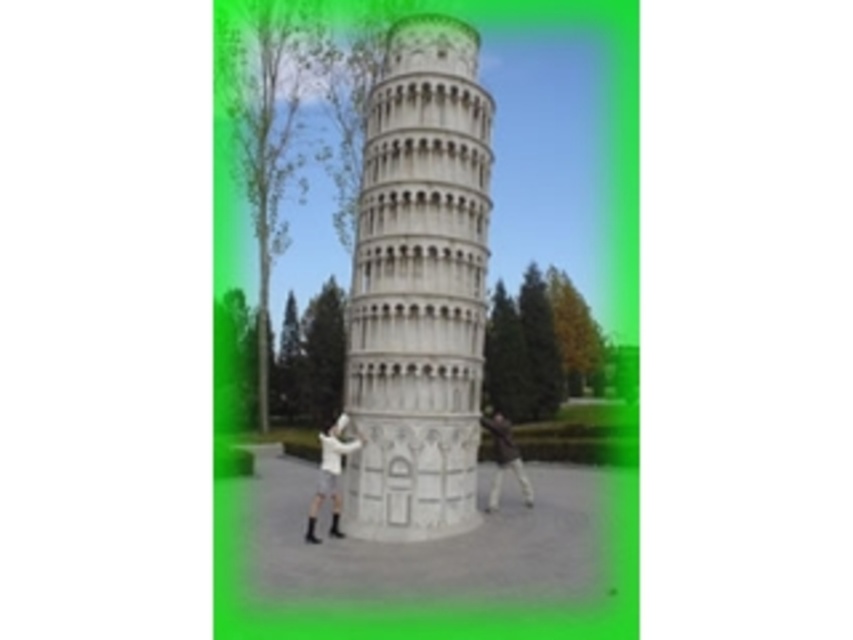
Question: Does white fabric shirt at center have a smaller size compared to dark brown leather jacket at lower right?

Choices:
 (A) yes
 (B) no

Answer: (A)

Question: From the image, what is the correct spatial relationship of white stone tower at center in relation to white fabric shirt at center?

Choices:
 (A) right
 (B) left

Answer: (A)

Question: Does white stone tower at center have a smaller size compared to white fabric shirt at center?

Choices:
 (A) yes
 (B) no

Answer: (B)

Question: Which of the following is the closest to the observer?

Choices:
 (A) dark brown leather jacket at lower right
 (B) white fabric shirt at center
 (C) white stone tower at center

Answer: (C)

Question: Which point appears farthest from the camera in this image?

Choices:
 (A) (456, 211)
 (B) (497, 486)

Answer: (B)

Question: Which of the following is the farthest from the observer?

Choices:
 (A) (434, 84)
 (B) (332, 440)

Answer: (A)